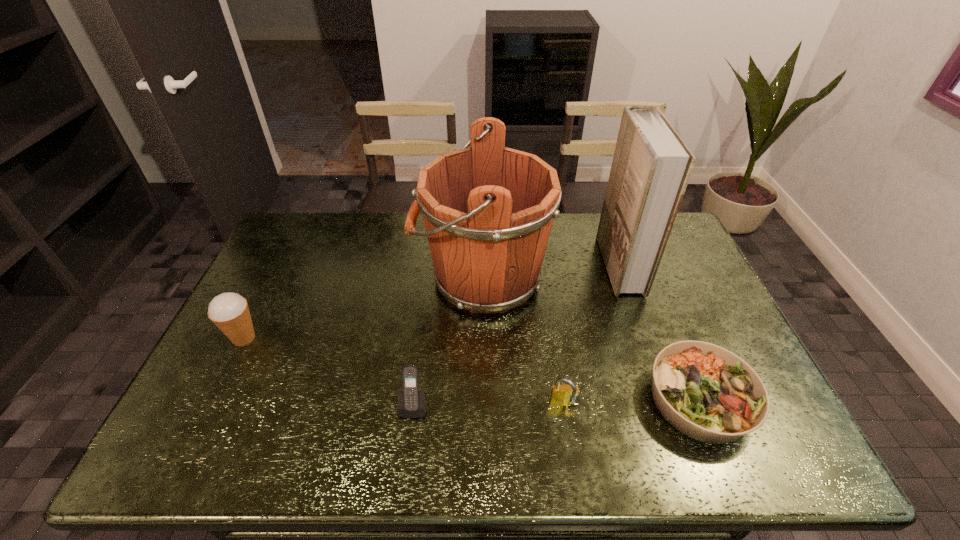
Locate an element on the screen. The width and height of the screenshot is (960, 540). object that is at the left edge is located at coordinates (229, 311).

You are a GUI agent. You are given a task and a screenshot of the screen. Output one action in this format:
    pyautogui.click(x=<x>, y=<y>)
    Task: Click on the object located at the right edge
    Image resolution: width=960 pixels, height=540 pixels.
    Given the screenshot: What is the action you would take?
    pyautogui.click(x=706, y=392)

Locate an element on the screen. The width and height of the screenshot is (960, 540). object located in the near right corner section of the desktop is located at coordinates (706, 392).

You are a GUI agent. You are given a task and a screenshot of the screen. Output one action in this format:
    pyautogui.click(x=<x>, y=<y>)
    Task: Click on the free space at the near edge of the desktop
    This screenshot has width=960, height=540.
    Given the screenshot: What is the action you would take?
    pyautogui.click(x=570, y=450)

Find the location of a particular element. vacant position at the left edge of the desktop is located at coordinates (262, 308).

The width and height of the screenshot is (960, 540). In the image, there is a desktop. What are the coordinates of `free space at the right edge` in the screenshot? It's located at (722, 327).

Identify the location of blank space at the far left corner. The height and width of the screenshot is (540, 960). (302, 229).

In the image, there is a desktop. Identify the location of vacant space at the far right corner. The image size is (960, 540). (667, 250).

Identify the location of empty space that is in between the icecream and the shortest object. This screenshot has height=540, width=960. (472, 369).

The width and height of the screenshot is (960, 540). What are the coordinates of `vacant area between the padlock and the salad plate` in the screenshot? It's located at (632, 402).